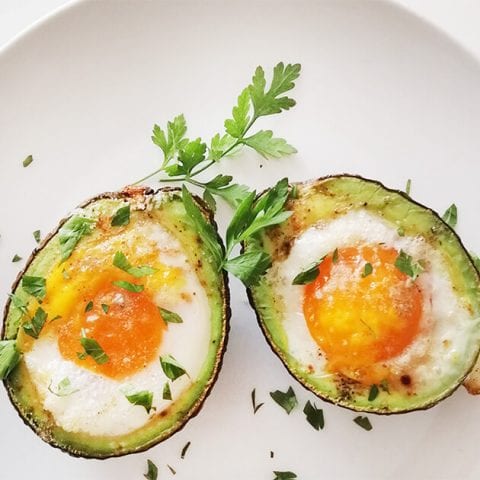
At what (x,y) coordinates should I click in order to perform the action: click on table. Please return your answer as a coordinate pair (x, y). This screenshot has height=480, width=480. Looking at the image, I should click on pos(448,24).